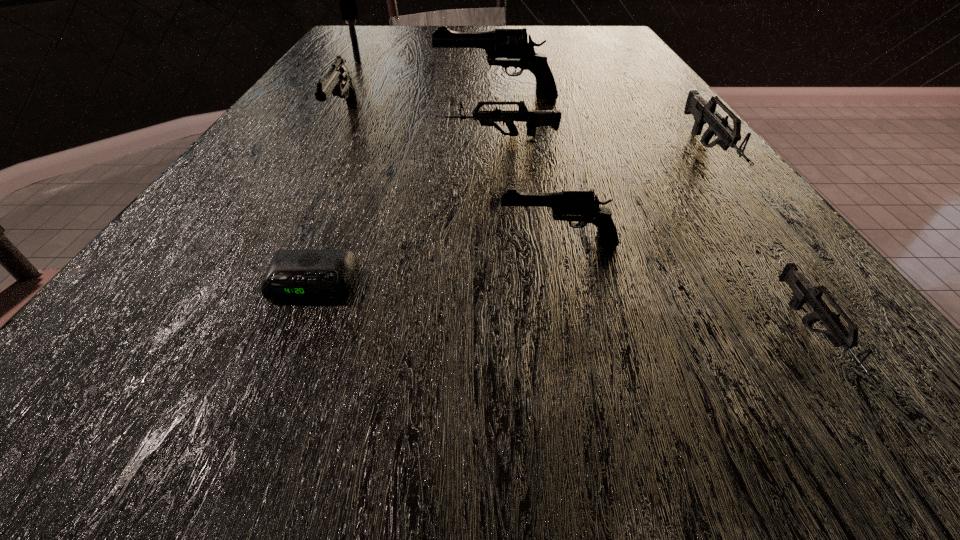
Identify which grey gun is located as the nearest to the hairbrush. Please provide its 2D coordinates. Your answer should be formatted as a tuple, i.e. [(x, y)], where the tuple contains the x and y coordinates of a point satisfying the conditions above.

[(534, 118)]

Identify the location of free spot that satisfies the following two spatial constraints: 1. at the end of the barrel of the biggest black gun; 2. on the display of the alarm clock. (510, 283).

Identify the location of vacant space that satisfies the following two spatial constraints: 1. at the end of the barrel of the biggest black gun; 2. on the display of the shortest object. (510, 283).